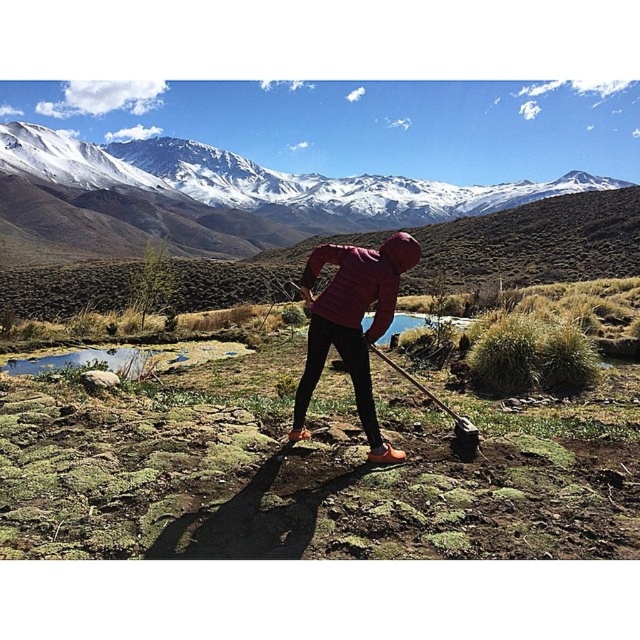
You are planning to take a photo of the snowy white mountain at upper center and the matte pink jacket at center. Which object will occupy more space in the photo?

The snowy white mountain at upper center will occupy more space in the photo because its width is larger than that of the matte pink jacket at center.